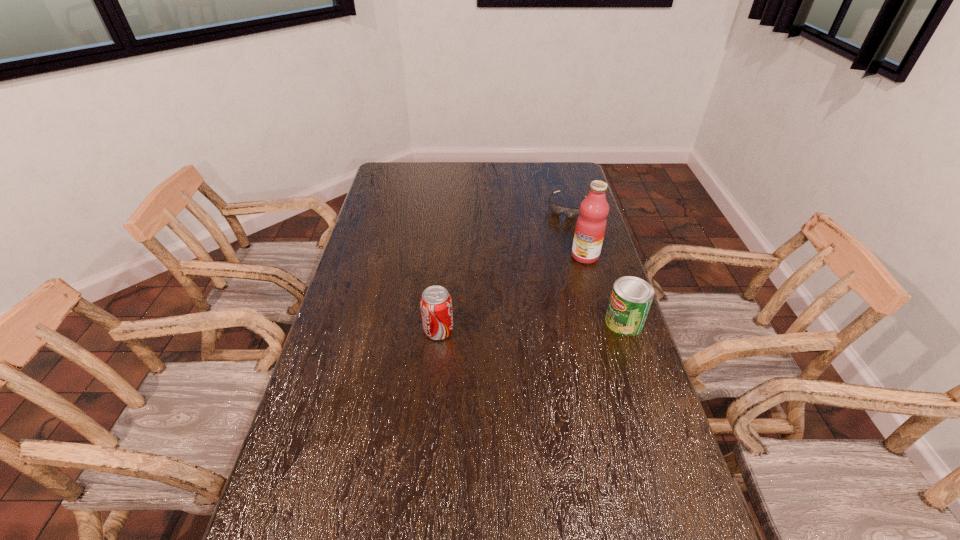
Identify the location of soda. (436, 305).

Identify the location of can. The height and width of the screenshot is (540, 960). (631, 297).

Locate an element on the screen. goggles is located at coordinates (x=570, y=212).

Image resolution: width=960 pixels, height=540 pixels. What are the coordinates of `the shortest object` in the screenshot? It's located at (570, 212).

You are a GUI agent. You are given a task and a screenshot of the screen. Output one action in this format:
    pyautogui.click(x=<x>, y=<y>)
    Task: Click on the tallest object
    
    Given the screenshot: What is the action you would take?
    pyautogui.click(x=590, y=228)

Image resolution: width=960 pixels, height=540 pixels. What are the coordinates of `the second farthest object` in the screenshot? It's located at click(x=590, y=228).

The image size is (960, 540). In order to click on vacant space located 0.080m on the right of the soda in this screenshot , I will do `click(480, 331)`.

Where is `free region located 0.090m on the left of the can`? Image resolution: width=960 pixels, height=540 pixels. free region located 0.090m on the left of the can is located at coordinates (577, 322).

The width and height of the screenshot is (960, 540). What are the coordinates of `vacant space located 0.200m on the lenses of the goggles` in the screenshot? It's located at (548, 246).

You are a GUI agent. You are given a task and a screenshot of the screen. Output one action in this format:
    pyautogui.click(x=<x>, y=<y>)
    Task: Click on the vacant space located 0.050m on the lenses of the goggles
    The image size is (960, 540).
    Given the screenshot: What is the action you would take?
    pyautogui.click(x=559, y=225)